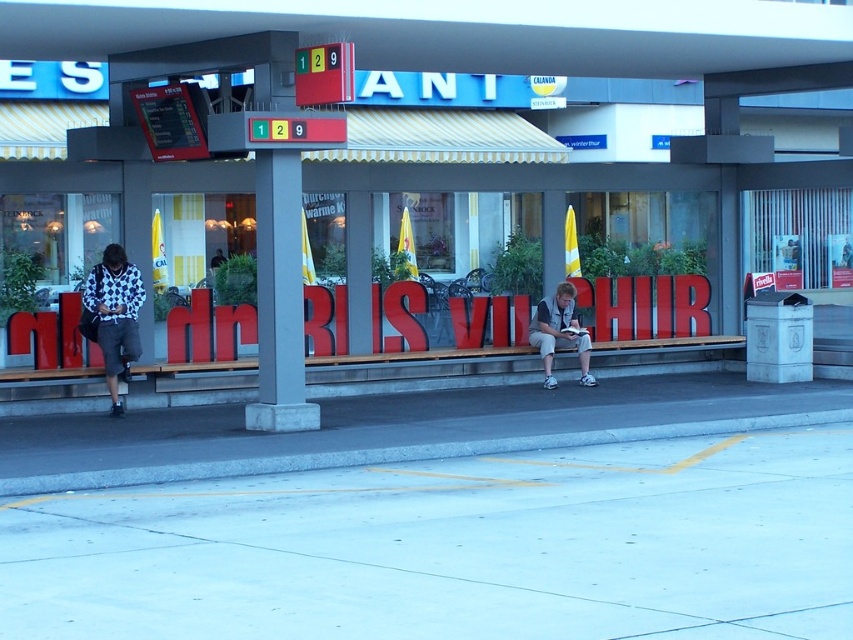
Question: Which of the following is the farthest from the observer?

Choices:
 (A) (566, 371)
 (B) (113, 324)
 (C) (314, 422)
 (D) (535, 326)

Answer: (A)

Question: Does wooden bench at center appear on the left side of patterned fabric jacket at left?

Choices:
 (A) yes
 (B) no

Answer: (B)

Question: Is wooden bench at center wider than gray concrete curb at lower center?

Choices:
 (A) yes
 (B) no

Answer: (A)

Question: Among these objects, which one is farthest from the camera?

Choices:
 (A) patterned fabric jacket at left
 (B) gray concrete pavement at lower center

Answer: (A)

Question: Is gray concrete curb at lower center behind light gray fabric jacket at center?

Choices:
 (A) yes
 (B) no

Answer: (B)

Question: Which object is positioned farthest from the light gray fabric jacket at center?

Choices:
 (A) gray concrete pillar at center
 (B) wooden bench at center

Answer: (A)